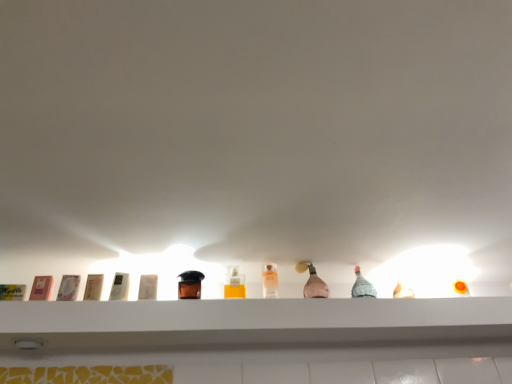
How much space does matte brown lotion at left, which ranks as the 4th toiletry in right-to-left order, occupy horizontally?

The width of matte brown lotion at left, which ranks as the 4th toiletry in right-to-left order, is 1.35 inches.

The width and height of the screenshot is (512, 384). I want to click on translucent glass bottle at center, the second bottle positioned from the left, so click(x=270, y=281).

The width and height of the screenshot is (512, 384). What do you see at coordinates (68, 288) in the screenshot? I see `matte pink soap at left, which ranks as the 5th toiletry in right-to-left order` at bounding box center [68, 288].

At what (x,y) coordinates should I click in order to perform the action: click on clear glass bottle at center, positioned as the second bottle in right-to-left order. Please return your answer as a coordinate pair (x, y). The width and height of the screenshot is (512, 384). Looking at the image, I should click on (234, 283).

The image size is (512, 384). Identify the location of matte brown lotion at left, placed as the 2th toiletry when sorted from left to right. (93, 287).

Is white glossy shelf at center to the left of translucent glass bottle at center, the second bottle positioned from the left, from the viewer's perspective?

Incorrect, white glossy shelf at center is not on the left side of translucent glass bottle at center, the second bottle positioned from the left.

Is white glossy shelf at center smaller than translucent glass bottle at center, the second bottle positioned from the left?

Incorrect, white glossy shelf at center is not smaller in size than translucent glass bottle at center, the second bottle positioned from the left.

From the image's perspective, which object appears higher, white glossy shelf at center or translucent glass bottle at center, which appears as the 1th bottle when viewed from the right?

translucent glass bottle at center, which appears as the 1th bottle when viewed from the right, appears higher in the image.

This screenshot has height=384, width=512. In order to click on toiletry that is the 1st object to the left of the white glossy shelf at center, starting at the anchor in this screenshot , I will do `click(190, 285)`.

Between point (182, 297) and point (106, 307), which one is positioned behind?

The point (182, 297) is behind.

Looking at this image, how much distance is there between brown leather toiletry at center, arranged as the fifth toiletry when viewed from the left, and white glossy shelf at center?

The distance of brown leather toiletry at center, arranged as the fifth toiletry when viewed from the left, from white glossy shelf at center is 11.94 inches.

Is brown leather toiletry at center, arranged as the fifth toiletry when viewed from the left, positioned far away from clear glass bottle at center, positioned as the second bottle in right-to-left order?

Actually, brown leather toiletry at center, arranged as the fifth toiletry when viewed from the left, and clear glass bottle at center, positioned as the second bottle in right-to-left order, are a little close together.

Does brown leather toiletry at center, arranged as the fifth toiletry when viewed from the left, turn towards clear glass bottle at center, placed as the first bottle when sorted from left to right?

No, brown leather toiletry at center, arranged as the fifth toiletry when viewed from the left, does not turn towards clear glass bottle at center, placed as the first bottle when sorted from left to right.

What's the angular difference between brown leather toiletry at center, arranged as the fifth toiletry when viewed from the left, and clear glass bottle at center, positioned as the second bottle in right-to-left order,'s facing directions?

They differ by 0.000353 degrees in their facing directions.

Which point is more distant from viewer, (185,288) or (237,273)?

The point (237,273) is behind.

Relative to white plastic container at center, the fourth toiletry from the left, is translucent glass bottle at center, which appears as the 1th bottle when viewed from the right, in front or behind?

Clearly, translucent glass bottle at center, which appears as the 1th bottle when viewed from the right, is behind white plastic container at center, the fourth toiletry from the left.

Could you tell me if translucent glass bottle at center, which appears as the 1th bottle when viewed from the right, is turned towards white plastic container at center, the fourth toiletry from the left?

No, translucent glass bottle at center, which appears as the 1th bottle when viewed from the right, is not turned towards white plastic container at center, the fourth toiletry from the left.

From a real-world perspective, is translucent glass bottle at center, the second bottle positioned from the left, above or below white plastic container at center, which is the second toiletry in right-to-left order?

Clearly, from a real-world perspective, translucent glass bottle at center, the second bottle positioned from the left, is above white plastic container at center, which is the second toiletry in right-to-left order.

Considering the sizes of translucent glass bottle at center, the second bottle positioned from the left, and white plastic container at center, the fourth toiletry from the left, in the image, is translucent glass bottle at center, the second bottle positioned from the left, bigger or smaller than white plastic container at center, the fourth toiletry from the left,?

translucent glass bottle at center, the second bottle positioned from the left, is bigger than white plastic container at center, the fourth toiletry from the left.

Between translucent glass bottle at center, which appears as the 1th bottle when viewed from the right, and white plastic container at center, which is the 3th toiletry in right-to-left order, which one has more height?

translucent glass bottle at center, which appears as the 1th bottle when viewed from the right, is taller.

Does translucent glass bottle at center, which appears as the 1th bottle when viewed from the right, touch white plastic container at center, positioned as the third toiletry in left-to-right order?

No.

From a real-world perspective, is translucent glass bottle at center, which appears as the 1th bottle when viewed from the right, above or below white plastic container at center, which is the 3th toiletry in right-to-left order?

Clearly, from a real-world perspective, translucent glass bottle at center, which appears as the 1th bottle when viewed from the right, is above white plastic container at center, which is the 3th toiletry in right-to-left order.

Based on the photo, is translucent glass bottle at center, the second bottle positioned from the left, oriented towards white plastic container at center, which is the 3th toiletry in right-to-left order?

No, translucent glass bottle at center, the second bottle positioned from the left, is not oriented towards white plastic container at center, which is the 3th toiletry in right-to-left order.

Between white glossy shelf at center and clear glass bottle at center, positioned as the second bottle in right-to-left order, which one has smaller width?

With smaller width is clear glass bottle at center, positioned as the second bottle in right-to-left order.

From a real-world perspective, is white glossy shelf at center positioned above or below clear glass bottle at center, placed as the first bottle when sorted from left to right?

In terms of real-world spatial position, white glossy shelf at center is below clear glass bottle at center, placed as the first bottle when sorted from left to right.

Which object is positioned more to the right, white glossy shelf at center or clear glass bottle at center, positioned as the second bottle in right-to-left order?

white glossy shelf at center is more to the right.

From the picture: In the image, is white plastic container at center, which is the 3th toiletry in right-to-left order, positioned in front of or behind pink glass bottle at center?

Visually, white plastic container at center, which is the 3th toiletry in right-to-left order, is located in front of pink glass bottle at center.

Is point (123, 276) farther from camera compared to point (324, 289)?

No, (123, 276) is in front of (324, 289).

Considering the relative sizes of white plastic container at center, positioned as the third toiletry in left-to-right order, and pink glass bottle at center in the image provided, is white plastic container at center, positioned as the third toiletry in left-to-right order, taller than pink glass bottle at center?

In fact, white plastic container at center, positioned as the third toiletry in left-to-right order, may be shorter than pink glass bottle at center.

Starting from the white glossy shelf at center, which bottle is the 1st one to the left? Please provide its 2D coordinates.

[(270, 281)]

Locate an element on the screen. The width and height of the screenshot is (512, 384). the 5th toiletry behind the white glossy shelf at center, counting from the anchor's position is located at coordinates (190, 285).

From the image, which object appears to be farther from brown leather toiletry at center, arranged as the 1th toiletry when viewed from the right, translucent glass bottle at center, the second bottle positioned from the left, or white plastic container at center, which is the second toiletry in right-to-left order?

translucent glass bottle at center, the second bottle positioned from the left, is positioned further to the anchor brown leather toiletry at center, arranged as the 1th toiletry when viewed from the right.

From the image, which object appears to be farther from brown leather toiletry at center, arranged as the fifth toiletry when viewed from the left, clear glass bottle at center, positioned as the second bottle in right-to-left order, or pink glass bottle at center?

The object further to brown leather toiletry at center, arranged as the fifth toiletry when viewed from the left, is pink glass bottle at center.

Which object lies further to the anchor point translucent glass bottle at center, which appears as the 1th bottle when viewed from the right, clear glass bottle at center, positioned as the second bottle in right-to-left order, or white plastic container at center, which is the 3th toiletry in right-to-left order?

white plastic container at center, which is the 3th toiletry in right-to-left order, is positioned further to the anchor translucent glass bottle at center, which appears as the 1th bottle when viewed from the right.

When comparing their distances from white plastic container at center, the fourth toiletry from the left, does matte brown lotion at left, which ranks as the 4th toiletry in right-to-left order, or white glossy shelf at center seem further?

white glossy shelf at center is further to white plastic container at center, the fourth toiletry from the left.

Which object lies further to the anchor point pink glass bottle at center, matte pink soap at left, which ranks as the 5th toiletry in right-to-left order, or matte brown lotion at left, which ranks as the 4th toiletry in right-to-left order?

The object further to pink glass bottle at center is matte pink soap at left, which ranks as the 5th toiletry in right-to-left order.

Estimate the real-world distances between objects in this image. Which object is further from clear glass bottle at center, positioned as the second bottle in right-to-left order, white glossy shelf at center or translucent glass bottle at center, which appears as the 1th bottle when viewed from the right?

Among the two, white glossy shelf at center is located further to clear glass bottle at center, positioned as the second bottle in right-to-left order.

Consider the image. Estimate the real-world distances between objects in this image. Which object is closer to white plastic container at center, which is the 3th toiletry in right-to-left order, translucent glass bottle at center, the second bottle positioned from the left, or matte pink soap at left, which ranks as the first toiletry in left-to-right order?

Among the two, matte pink soap at left, which ranks as the first toiletry in left-to-right order, is located nearer to white plastic container at center, which is the 3th toiletry in right-to-left order.

When comparing their distances from clear glass bottle at center, placed as the first bottle when sorted from left to right, does matte pink soap at left, which ranks as the 5th toiletry in right-to-left order, or translucent glass bottle at center, the second bottle positioned from the left, seem further?

matte pink soap at left, which ranks as the 5th toiletry in right-to-left order.

Locate an element on the screen. The height and width of the screenshot is (384, 512). toiletry between matte pink soap at left, which ranks as the first toiletry in left-to-right order, and white plastic container at center, which is the 3th toiletry in right-to-left order is located at coordinates (93, 287).

Where is `toiletry situated between matte brown lotion at left, placed as the 2th toiletry when sorted from left to right, and white plastic container at center, which is the second toiletry in right-to-left order, from left to right`? The width and height of the screenshot is (512, 384). toiletry situated between matte brown lotion at left, placed as the 2th toiletry when sorted from left to right, and white plastic container at center, which is the second toiletry in right-to-left order, from left to right is located at coordinates (120, 286).

The height and width of the screenshot is (384, 512). Find the location of `shelf between brown leather toiletry at center, arranged as the fifth toiletry when viewed from the left, and pink glass bottle at center, in the horizontal direction`. shelf between brown leather toiletry at center, arranged as the fifth toiletry when viewed from the left, and pink glass bottle at center, in the horizontal direction is located at coordinates (250, 314).

Image resolution: width=512 pixels, height=384 pixels. I want to click on bottle positioned between white glossy shelf at center and translucent glass bottle at center, the second bottle positioned from the left, from near to far, so click(x=234, y=283).